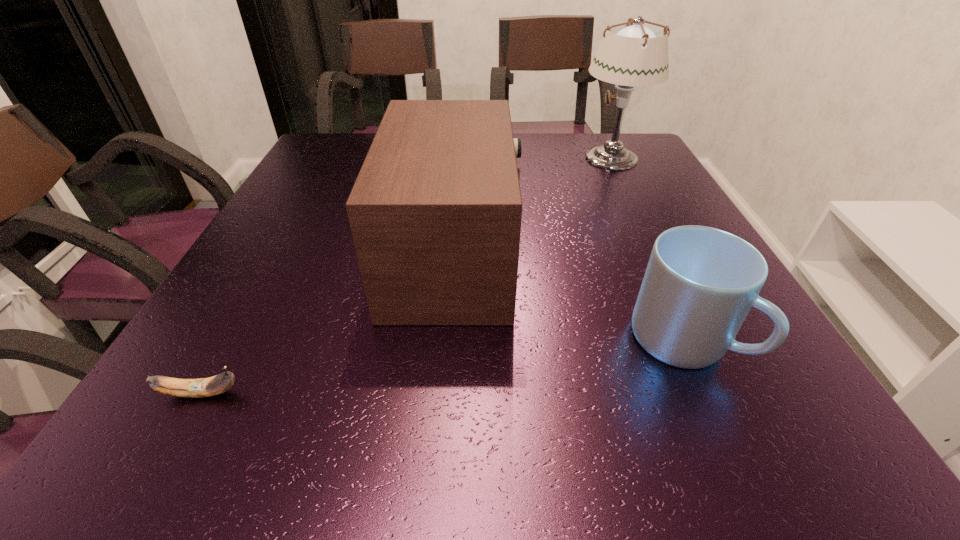
Where is `empty space that is in between the tallest object and the second object from left to right`? empty space that is in between the tallest object and the second object from left to right is located at coordinates (534, 206).

You are a GUI agent. You are given a task and a screenshot of the screen. Output one action in this format:
    pyautogui.click(x=<x>, y=<y>)
    Task: Click on the free space between the radio receiver and the farthest object
    Image resolution: width=960 pixels, height=540 pixels.
    Given the screenshot: What is the action you would take?
    pyautogui.click(x=534, y=206)

This screenshot has width=960, height=540. In order to click on free space between the mug and the second tallest object in this screenshot , I will do `click(569, 298)`.

At what (x,y) coordinates should I click in order to perform the action: click on free space between the tallest object and the second shortest object. Please return your answer as a coordinate pair (x, y). The width and height of the screenshot is (960, 540). Looking at the image, I should click on (647, 249).

Identify the location of the third closest object to the banana. The image size is (960, 540). coord(632,54).

This screenshot has height=540, width=960. Identify the location of object that ranks as the third closest to the farthest object. (202, 387).

In order to click on free spot that satisfies the following two spatial constraints: 1. on the front side of the mug; 2. on the peel of the leftmost object in this screenshot , I will do `click(707, 393)`.

I want to click on free point that satisfies the following two spatial constraints: 1. on the front-facing side of the second tallest object; 2. on the right side of the mug, so click(450, 341).

The width and height of the screenshot is (960, 540). In order to click on vacant area in the image that satisfies the following two spatial constraints: 1. on the lampshade of the tallest object; 2. on the front side of the mug in this screenshot , I will do `click(702, 341)`.

Find the location of a particular element. blank area in the image that satisfies the following two spatial constraints: 1. on the front-facing side of the mug; 2. on the left side of the third shortest object is located at coordinates (450, 341).